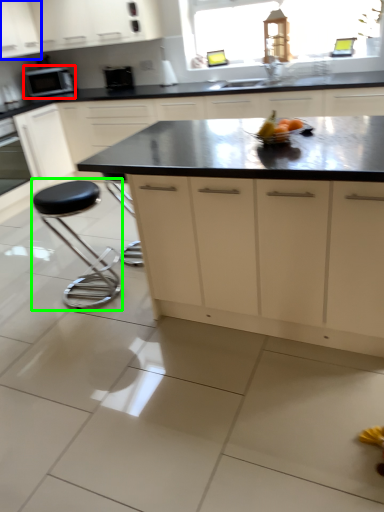
Question: Which is nearer to the home appliance (highlighted by a red box)? cabinetry (highlighted by a blue box) or stool (highlighted by a green box).

Choices:
 (A) cabinetry
 (B) stool

Answer: (A)